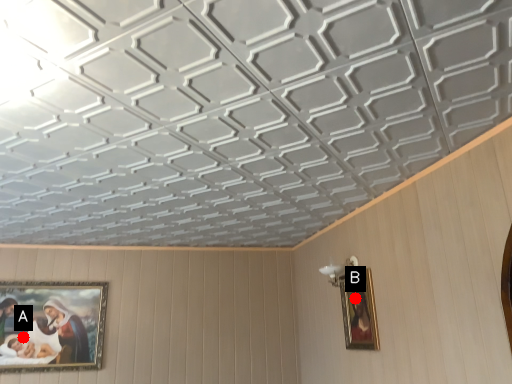
Question: Two points are circled on the image, labeled by A and B beside each circle. Which point is farther to the camera?

Choices:
 (A) A is further
 (B) B is further

Answer: (A)